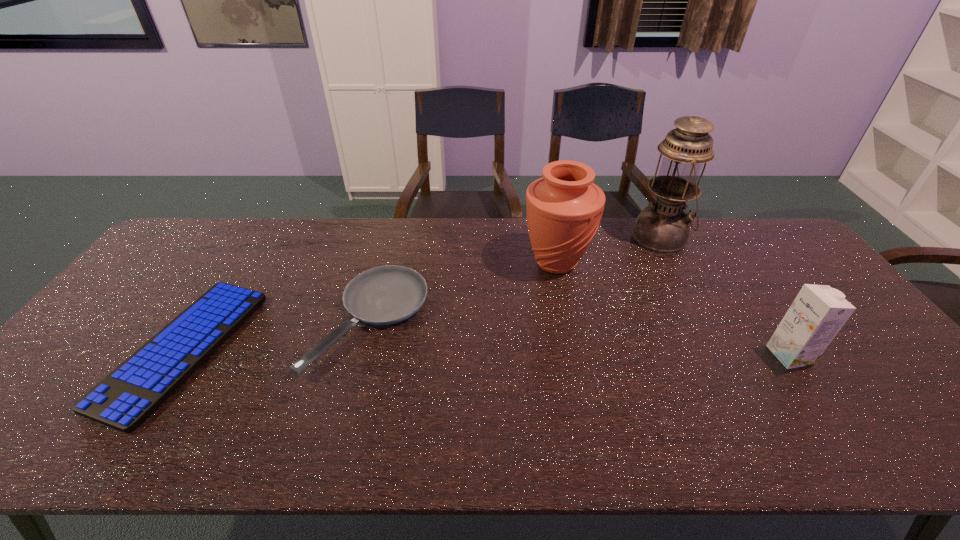
In order to click on free space located on the left of the tallest object in this screenshot , I will do `click(556, 238)`.

Where is `free space located 0.050m on the right of the third object from left to right`? free space located 0.050m on the right of the third object from left to right is located at coordinates (607, 262).

Find the location of `vacant space located on the front of the rightmost object`. vacant space located on the front of the rightmost object is located at coordinates (842, 433).

Where is `free spot located 0.150m on the front of the fourth object from right to left`? free spot located 0.150m on the front of the fourth object from right to left is located at coordinates (340, 439).

You are a GUI agent. You are given a task and a screenshot of the screen. Output one action in this format:
    pyautogui.click(x=<x>, y=<y>)
    Task: Click on the vacant space located on the right of the shortest object
    This screenshot has height=540, width=960.
    Given the screenshot: What is the action you would take?
    pos(369,349)

Identify the location of oil lamp situated at the far edge. (663, 227).

At what (x,y) coordinates should I click in order to perform the action: click on vase positioned at the far edge. Please return your answer as a coordinate pair (x, y). The height and width of the screenshot is (540, 960). Looking at the image, I should click on click(x=564, y=208).

This screenshot has height=540, width=960. What are the coordinates of `object that is at the near edge` in the screenshot? It's located at (130, 394).

Where is `object present at the left edge`? Image resolution: width=960 pixels, height=540 pixels. object present at the left edge is located at coordinates (130, 394).

Find the location of a particular element. The width and height of the screenshot is (960, 540). object located in the near left corner section of the desktop is located at coordinates (130, 394).